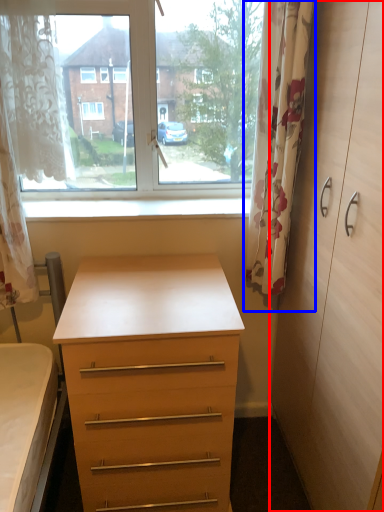
Question: Which object is closer to the camera taking this photo, dresser (highlighted by a red box) or curtain (highlighted by a blue box)?

Choices:
 (A) dresser
 (B) curtain

Answer: (A)